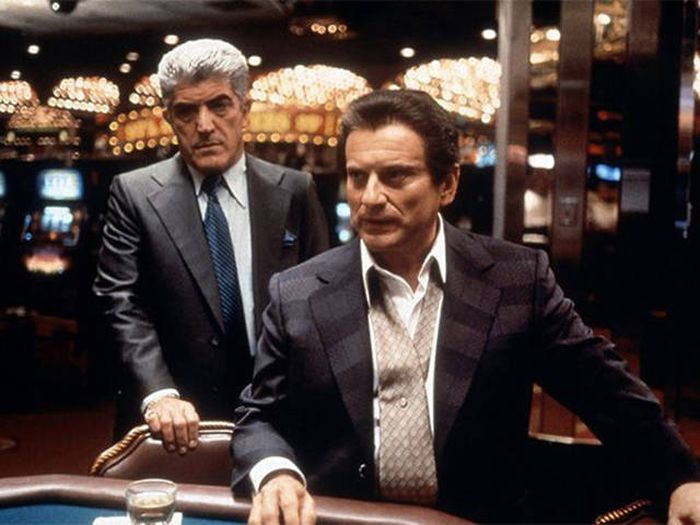
The image size is (700, 525). Find the location of `ceiling`. ceiling is located at coordinates (120, 23).